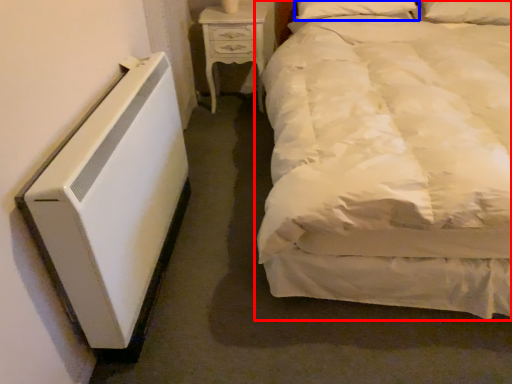
Question: Which object appears closest to the camera in this image, bed (highlighted by a red box) or pillow (highlighted by a blue box)?

Choices:
 (A) bed
 (B) pillow

Answer: (A)